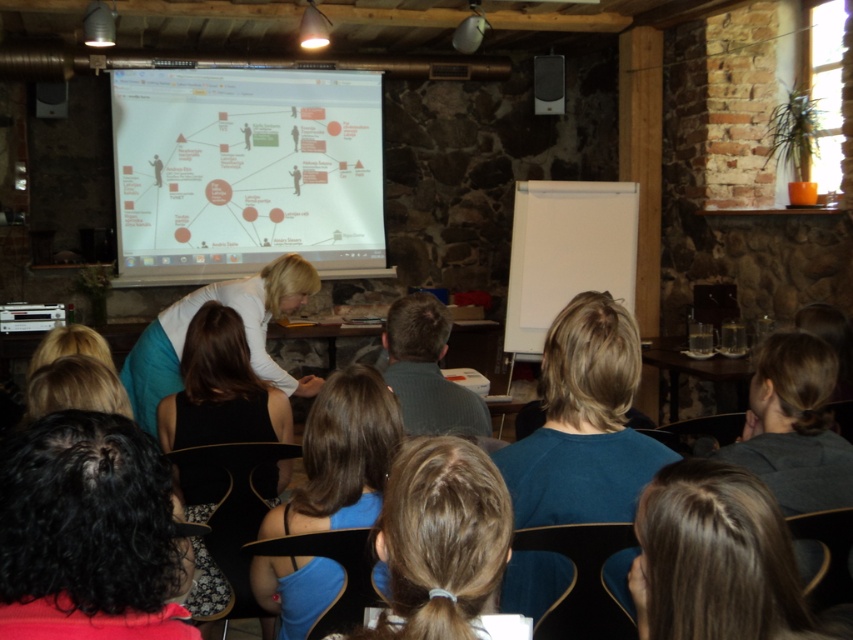
In the scene shown: You are an attendee at the presentation and want to take a photo of the white glossy projector screen at upper center. The room has a rustic decor with stone walls and wooden beams. Where should you position yourself to ensure the screen is fully visible in your photo without any obstruction from the presenter or other attendees?

To capture the white glossy projector screen at upper center without obstruction, position yourself directly in front of the screen, aligned with its center. This ensures the presenter and other attendees are not blocking the view. Since the screen is at point (245, 170), centering your position relative to that coordinate will provide an unobstructed view.

You are organizing a photoshoot and need to decide which clothing item to feature first based on size. Which of the two items, the teal fabric shirt at center or the black fabric dress at center, should you choose if you want to highlight the larger one?

The teal fabric shirt at center is larger in size than the black fabric dress at center, so you should choose the teal fabric shirt at center to highlight the larger one.

You are an attendee sitting at the back of the room. You notice two people in front of you with distinct hairstyles. One has black curly hair at lower left and the other has blue fabric hair at center. Which hairstyle is closer to you?

The black curly hair at lower left is closer to the viewer than the blue fabric hair at center, so the black curly hair at lower left is closer to you.